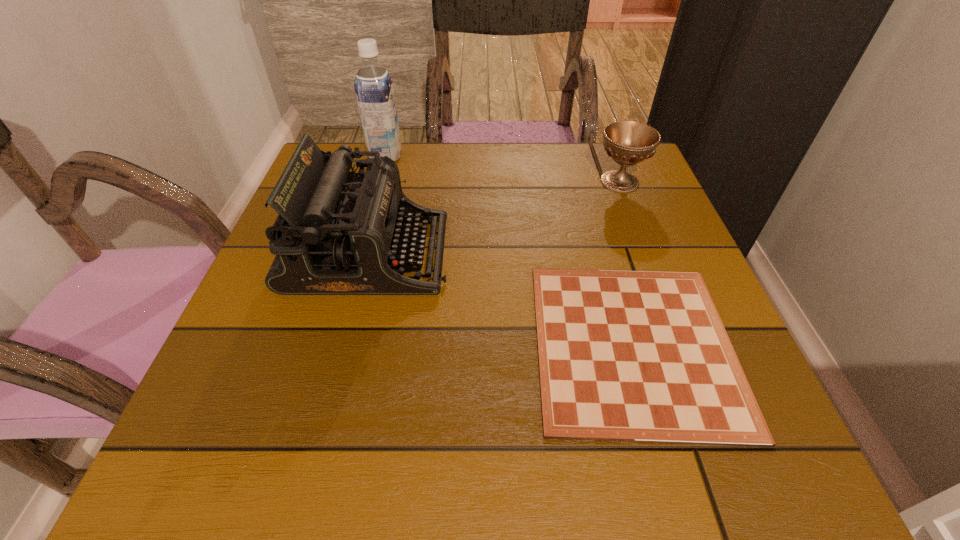
Where is `free location that satisfies the following two spatial constraints: 1. on the keyboard of the checkerboard; 2. on the right side of the third shortest object`? Image resolution: width=960 pixels, height=540 pixels. free location that satisfies the following two spatial constraints: 1. on the keyboard of the checkerboard; 2. on the right side of the third shortest object is located at coordinates (345, 345).

Identify the location of vacant space that satisfies the following two spatial constraints: 1. on the keyboard of the typewriter; 2. on the left side of the checkerboard. (345, 345).

Where is `vacant space that satisfies the following two spatial constraints: 1. on the keyboard of the checkerboard; 2. on the left side of the third shortest object`? This screenshot has width=960, height=540. vacant space that satisfies the following two spatial constraints: 1. on the keyboard of the checkerboard; 2. on the left side of the third shortest object is located at coordinates point(345,345).